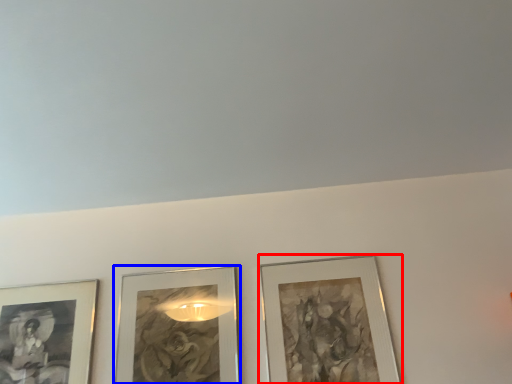
Question: Which object appears farthest to the camera in this image, picture frame (highlighted by a red box) or picture frame (highlighted by a blue box)?

Choices:
 (A) picture frame
 (B) picture frame

Answer: (B)